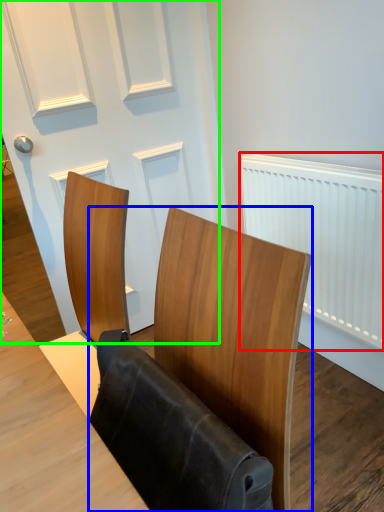
Question: Which object is positioned farthest from radiator (highlighted by a red box)? Select from furniture (highlighted by a blue box) and door (highlighted by a green box).

Choices:
 (A) furniture
 (B) door

Answer: (A)